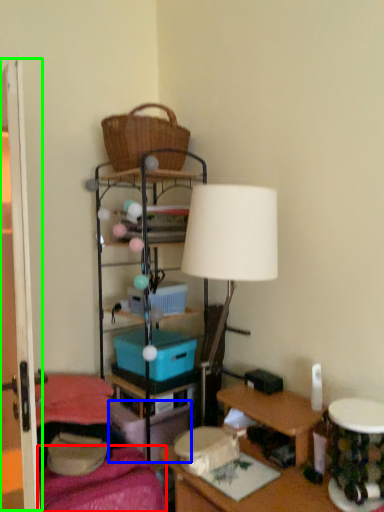
Question: Which object is positioned farthest from bedding (highlighted by a red box)? Select from storage box (highlighted by a blue box) and glass door (highlighted by a green box).

Choices:
 (A) storage box
 (B) glass door

Answer: (B)